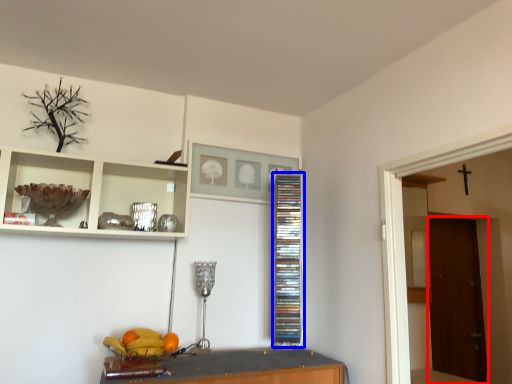
Question: Which object appears farthest to the camera in this image, door (highlighted by a red box) or cabinet (highlighted by a blue box)?

Choices:
 (A) door
 (B) cabinet

Answer: (A)